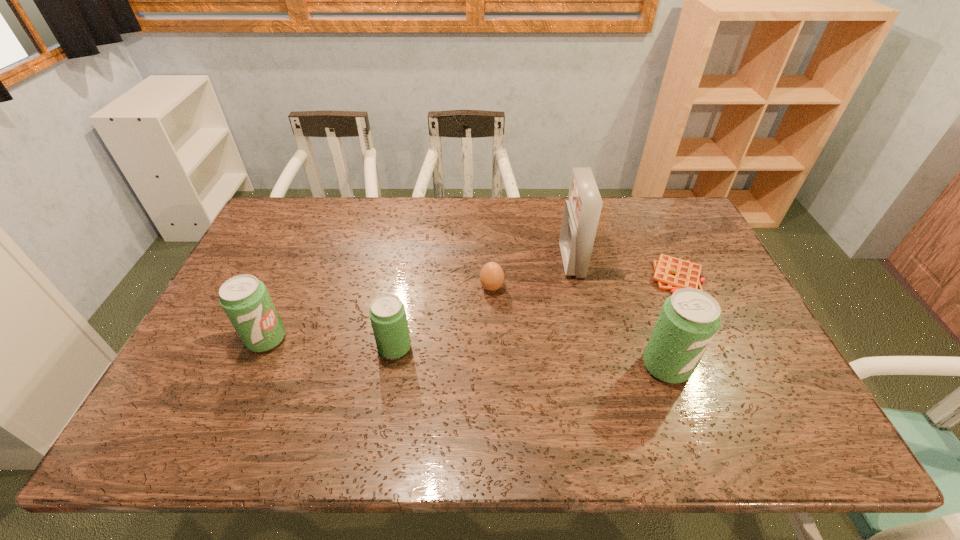
Locate an element on the screen. free spot located on the left of the leftmost object is located at coordinates (212, 339).

The height and width of the screenshot is (540, 960). I want to click on vacant space located 0.370m on the back of the fourth tallest object, so click(413, 245).

Where is `free space located 0.120m on the back of the rightmost soda`? This screenshot has height=540, width=960. free space located 0.120m on the back of the rightmost soda is located at coordinates (647, 312).

Where is `free point located 0.330m on the front-facing side of the first-aid kit`? free point located 0.330m on the front-facing side of the first-aid kit is located at coordinates (456, 261).

The image size is (960, 540). I want to click on vacant space located on the front-facing side of the first-aid kit, so click(482, 261).

Image resolution: width=960 pixels, height=540 pixels. In order to click on free space located 0.250m on the front-facing side of the first-aid kit in this screenshot , I will do `click(482, 261)`.

This screenshot has width=960, height=540. I want to click on blank space located on the left of the waffle, so click(516, 277).

Locate an element on the screen. This screenshot has height=540, width=960. free region located 0.180m on the back of the fifth tallest object is located at coordinates (491, 241).

You are a GUI agent. You are given a task and a screenshot of the screen. Output one action in this format:
    pyautogui.click(x=<x>, y=<y>)
    Task: Click on the object located in the near edge section of the desktop
    The height and width of the screenshot is (540, 960).
    Given the screenshot: What is the action you would take?
    pyautogui.click(x=689, y=319)

The image size is (960, 540). Find the location of `object located at the left edge`. object located at the left edge is located at coordinates (245, 299).